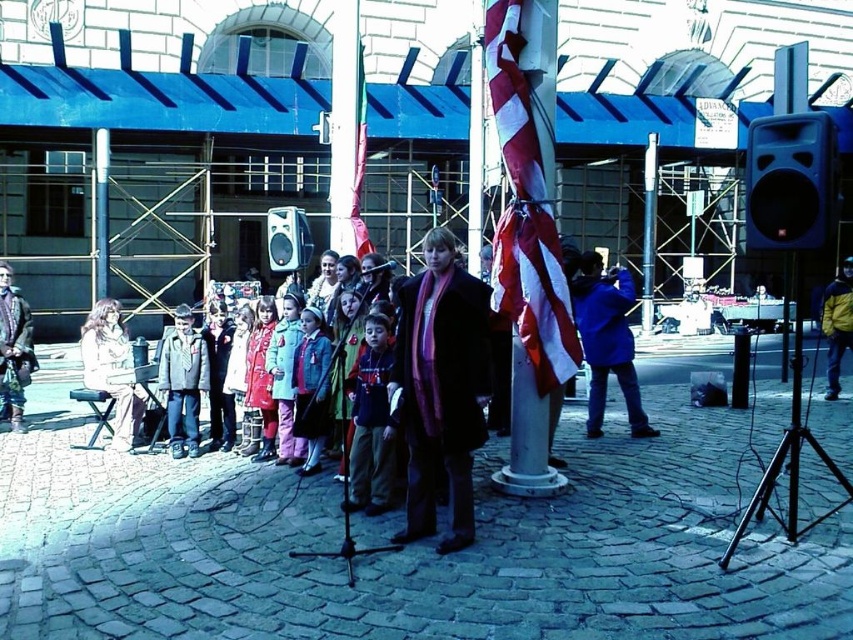
You are a photographer positioned at the back of the scene. You need to take a photo that includes both the matte white dress at left and the denim jacket at center. Which object will appear closer to the camera in the photo?

The matte white dress at left will appear closer to the camera in the photo because it is further to the viewer than the denim jacket at center.

You are a photographer at the event and need to capture both the dark gray jacket at center and the fluffy pink pants at center in a single shot. Which clothing item will appear bigger in the photo?

The dark gray jacket at center will appear bigger in the photo because it is larger in size than the fluffy pink pants at center.

You are standing at the microphone stand near the flagpole and want to walk to the point marked as point (628, 355) and point (189, 433). Which point will you reach first if you walk straight ahead?

You will reach point (189, 433) first because it is closer to you than point (628, 355), which is further away.